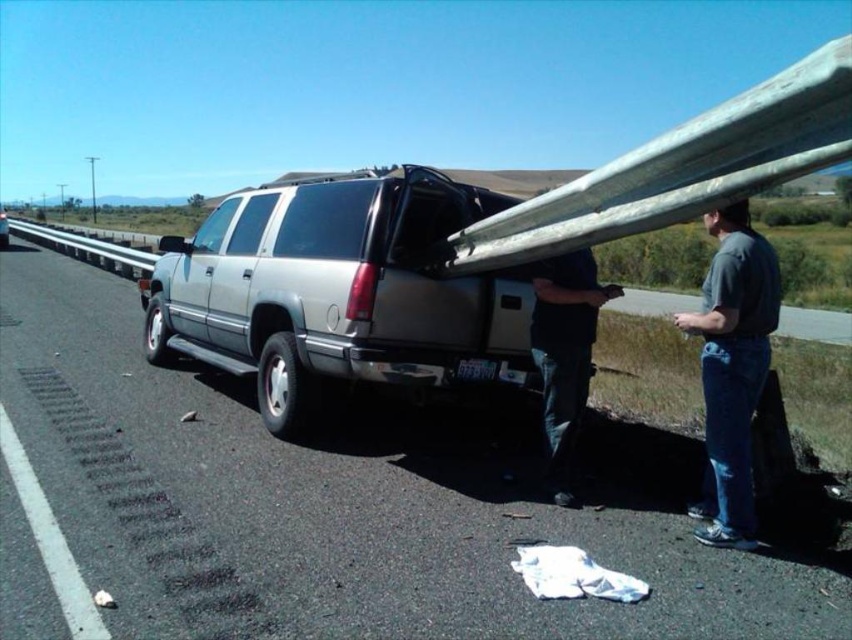
Which is behind, point (392, 461) or point (751, 531)?

Positioned behind is point (392, 461).

Which is more to the right, brushed metal highway at center or gray cotton shirt at right?

gray cotton shirt at right

Between point (412, 524) and point (741, 472), which one is positioned behind?

The point (412, 524) is more distant.

Where is `brushed metal highway at center`? The height and width of the screenshot is (640, 852). brushed metal highway at center is located at coordinates (348, 500).

Which is above, silver metallic suv at center or dark blue jeans at lower center?

silver metallic suv at center is above.

In the scene shown: Which is below, silver metallic suv at center or dark blue jeans at lower center?

dark blue jeans at lower center is lower down.

Image resolution: width=852 pixels, height=640 pixels. I want to click on silver metallic suv at center, so pyautogui.click(x=338, y=291).

You are a GUI agent. You are given a task and a screenshot of the screen. Output one action in this format:
    pyautogui.click(x=<x>, y=<y>)
    Task: Click on the silver metallic suv at center
    
    Given the screenshot: What is the action you would take?
    pyautogui.click(x=338, y=291)

This screenshot has height=640, width=852. What do you see at coordinates (348, 500) in the screenshot? I see `brushed metal highway at center` at bounding box center [348, 500].

Is point (377, 490) less distant than point (206, 349)?

That is True.

Describe the element at coordinates (348, 500) in the screenshot. The image size is (852, 640). I see `brushed metal highway at center` at that location.

At what (x,y) coordinates should I click in order to perform the action: click on brushed metal highway at center. Please return your answer as a coordinate pair (x, y). The height and width of the screenshot is (640, 852). Looking at the image, I should click on tap(348, 500).